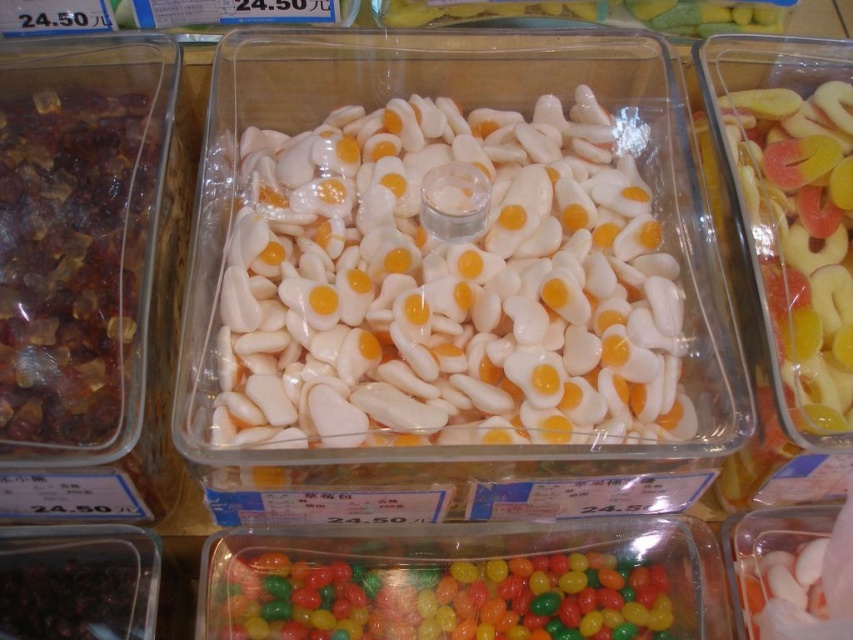
You are standing in front of the candy display and want to reach both points. Which point, point (38, 365) or point (511, 600), will you reach first?

Point (38, 365) is closer to the viewer than point (511, 600), so you will reach point (38, 365) first.

Consider the image. You are a customer at the candy store. You want to buy some candies. You see two containers of candies. One has white oval candies with yellow centers at center. The other has brown translucent gummy candies at left. Where is the point at coordinate (x=71, y=259) located?

The point at coordinate (x=71, y=259) is located on the brown translucent gummy candies at left.

You are a child trying to choose between the brown translucent gummy candies at left and the glossy plastic jelly beans at lower center. Which one is larger in size?

The brown translucent gummy candies at left is bigger than the glossy plastic jelly beans at lower center.